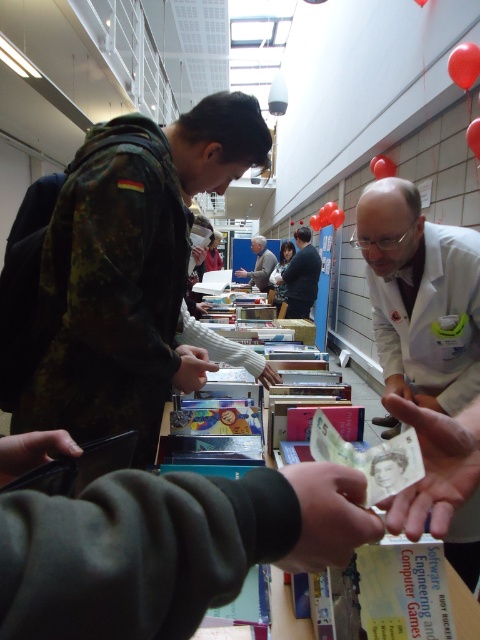
Is point (420, 385) positioned after point (251, 240)?

No.

Between white lab coat at center and light brown leather jacket at center, which one appears on the left side from the viewer's perspective?

From the viewer's perspective, light brown leather jacket at center appears more on the left side.

Identify the location of white lab coat at center. Image resolution: width=480 pixels, height=640 pixels. (420, 298).

Where is `white lab coat at center`? The image size is (480, 640). white lab coat at center is located at coordinates (420, 298).

Is point (282, 282) in front of point (240, 266)?

Yes, point (282, 282) is in front of point (240, 266).

Based on the photo, can you confirm if dark gray suit at center is shorter than light brown leather jacket at center?

No.

Which is behind, point (309, 314) or point (233, 262)?

The point (233, 262) is more distant.

Locate an element on the screen. This screenshot has width=480, height=640. dark gray suit at center is located at coordinates (300, 275).

Which is behind, point (274, 262) or point (288, 241)?

Positioned behind is point (288, 241).

Does light brown leather jacket at center appear over matte black jacket at center?

No, light brown leather jacket at center is not above matte black jacket at center.

Is point (242, 273) less distant than point (282, 259)?

Yes, it is in front of point (282, 259).

Where is `light brown leather jacket at center`? This screenshot has height=640, width=480. light brown leather jacket at center is located at coordinates (256, 264).